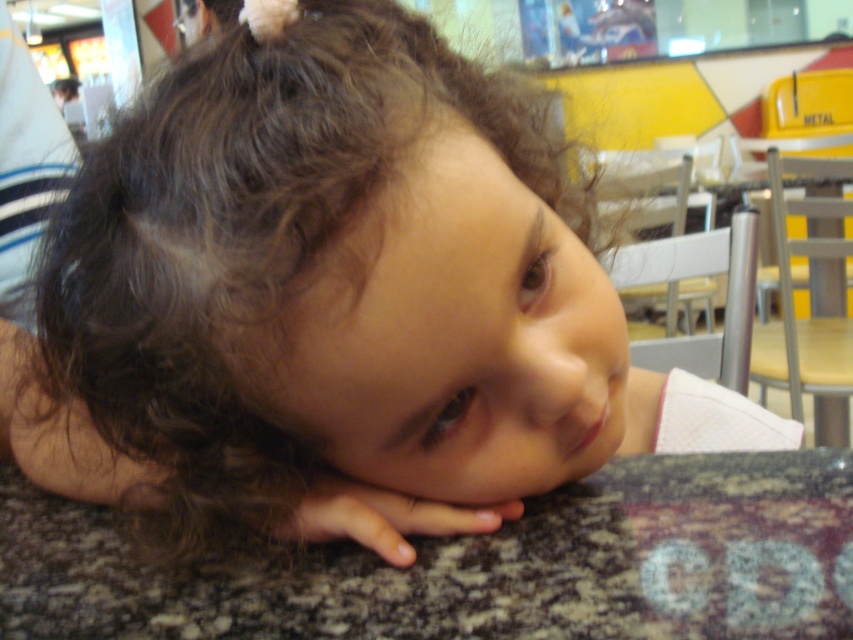
You are a parent trying to lift your child from the granite table at lower center. Considering the smooth skin hand at lower center is resting on it, can you safely lift the child without the hand slipping off?

The granite table at lower center is taller than the smooth skin hand at lower center. Since the table is taller, the hand is likely placed on its surface, so lifting the child carefully while supporting the hand should prevent it from slipping.

You are a delivery person who needs to place a small package on the granite table at lower center. According to the coordinates provided, where exactly should you place the package?

The granite table at lower center is located at coordinates point (480, 564), so you should place the package there.

Consider the image. You are holding a camera and want to take a photo of the point at coordinates (274,611). The camera is currently 15.64 inches away from that point. If you need the camera to be exactly 12 inches away to get a clear shot, should you move closer or farther away?

You should move closer to the point at coordinates (274,611) because the camera is currently 15.64 inches away, which is farther than the required 12 inches. Moving closer will reduce the distance to the desired 12 inches.